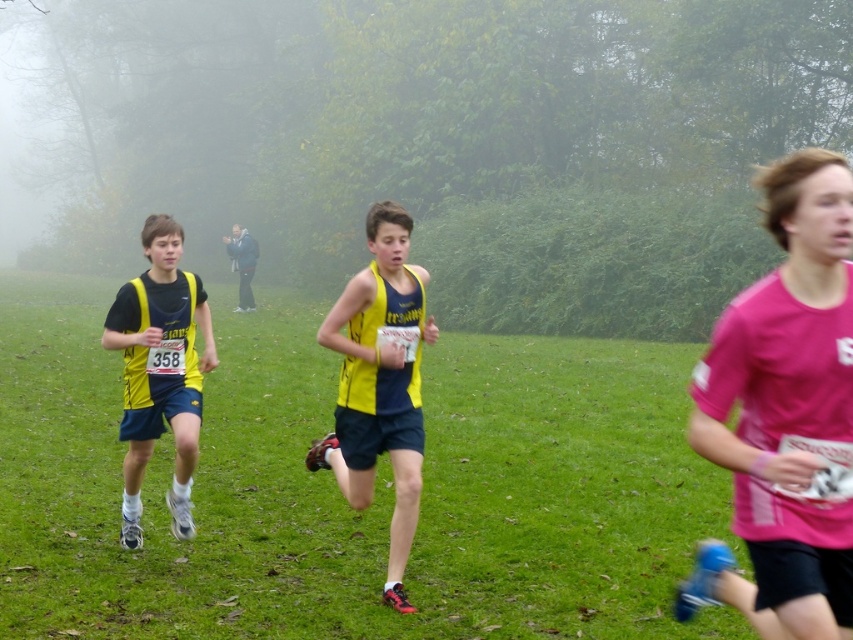
Is pink fabric shirt at right thinner than yellow matte tank top at center?

Correct, pink fabric shirt at right's width is less than yellow matte tank top at center's.

Who is more distant from viewer, (836, 173) or (393, 209)?

The point (393, 209) is behind.

You are a GUI agent. You are given a task and a screenshot of the screen. Output one action in this format:
    pyautogui.click(x=<x>, y=<y>)
    Task: Click on the pink fabric shirt at right
    The height and width of the screenshot is (640, 853).
    Given the screenshot: What is the action you would take?
    pyautogui.click(x=784, y=412)

Who is taller, yellow matte tank top at center or matte yellow and black running outfit at left?

yellow matte tank top at center is taller.

Can you confirm if yellow matte tank top at center is positioned to the left of matte yellow and black running outfit at left?

No, yellow matte tank top at center is not to the left of matte yellow and black running outfit at left.

In the scene shown: Who is more forward, (355, 300) or (169, 285)?

Point (355, 300) is more forward.

Image resolution: width=853 pixels, height=640 pixels. I want to click on yellow matte tank top at center, so click(379, 381).

Does pink fabric shirt at right come in front of matte yellow and black running outfit at left?

That is True.

At what (x,y) coordinates should I click in order to perform the action: click on pink fabric shirt at right. Please return your answer as a coordinate pair (x, y). The height and width of the screenshot is (640, 853). Looking at the image, I should click on (784, 412).

This screenshot has width=853, height=640. I want to click on pink fabric shirt at right, so click(x=784, y=412).